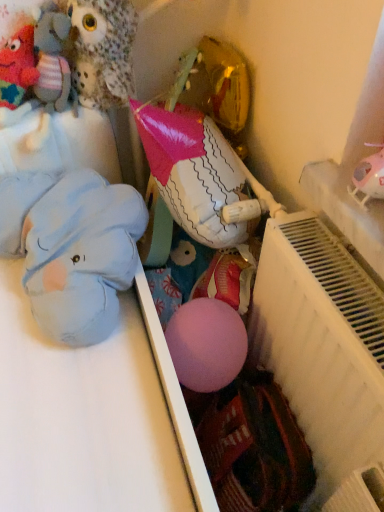
Question: Is white matte radiator at right situated inside blue plush elephant at left, which is counted as the 4th toy, starting from the top, or outside?

Choices:
 (A) inside
 (B) outside

Answer: (B)

Question: From a real-world perspective, is white matte radiator at right physically located above or below blue plush elephant at left, which is counted as the 4th toy, starting from the top?

Choices:
 (A) above
 (B) below

Answer: (B)

Question: Which of these objects is positioned farthest from the knitted wool toy at upper left, which appears as the third toy when ordered from the bottom?

Choices:
 (A) white matte radiator at right
 (B) blue plush elephant at left, which is counted as the 4th toy, starting from the top
 (C) fluffy fabric owl at upper left, the 4th toy ordered from the bottom
 (D) white glossy balloon at center, arranged as the 2th toy when ordered from the bottom

Answer: (A)

Question: Estimate the real-world distances between objects in this image. Which object is farther from the white glossy balloon at center, which appears as the 3th toy when viewed from the top?

Choices:
 (A) fluffy fabric owl at upper left, the 4th toy ordered from the bottom
 (B) blue plush elephant at left, which is counted as the 4th toy, starting from the top
 (C) white matte radiator at right
 (D) knitted wool toy at upper left, acting as the 2th toy starting from the top

Answer: (D)